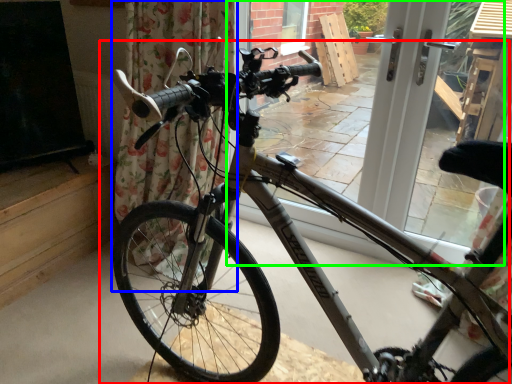
Question: Considering the real-world distances, which object is farthest from bicycle (highlighted by a red box)? curtain (highlighted by a blue box) or window frame (highlighted by a green box)?

Choices:
 (A) curtain
 (B) window frame

Answer: (B)